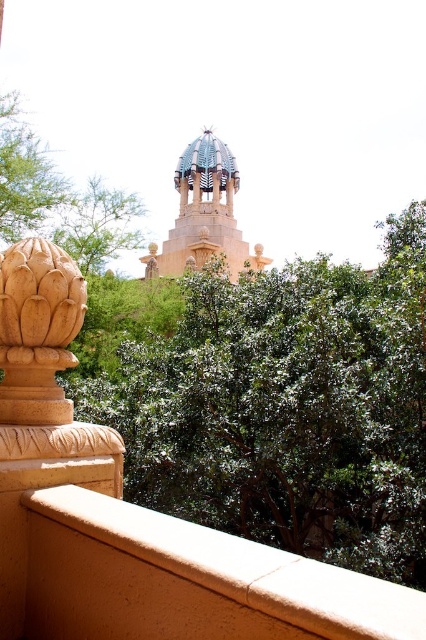
Can you confirm if green leafy tree at center is wider than golden stone finial at left?

Indeed, green leafy tree at center has a greater width compared to golden stone finial at left.

Does green leafy tree at center appear on the right side of golden stone finial at left?

Indeed, green leafy tree at center is positioned on the right side of golden stone finial at left.

Who is more forward, (268, 333) or (34, 380)?

Positioned in front is point (34, 380).

You are a GUI agent. You are given a task and a screenshot of the screen. Output one action in this format:
    pyautogui.click(x=<x>, y=<y>)
    Task: Click on the green leafy tree at center
    
    Given the screenshot: What is the action you would take?
    pyautogui.click(x=287, y=406)

Is smooth beige ledge at lower left closer to the viewer compared to green leafy tree at upper center?

Yes, it is in front of green leafy tree at upper center.

Between point (65, 605) and point (80, 260), which one is positioned behind?

Positioned behind is point (80, 260).

At what (x,y) coordinates should I click in order to perform the action: click on smooth beige ledge at lower left. Please return your answer as a coordinate pair (x, y). This screenshot has width=426, height=640. Looking at the image, I should click on (189, 580).

Between point (37, 378) and point (109, 221), which one is positioned in front?

Point (37, 378)

Which is behind, point (54, 250) or point (112, 232)?

Positioned behind is point (112, 232).

At what (x,y) coordinates should I click in order to perform the action: click on golden stone finial at left. Please return your answer as a coordinate pair (x, y). The image size is (426, 640). Looking at the image, I should click on (37, 330).

Locate an element on the screen. This screenshot has width=426, height=640. golden stone finial at left is located at coordinates (37, 330).